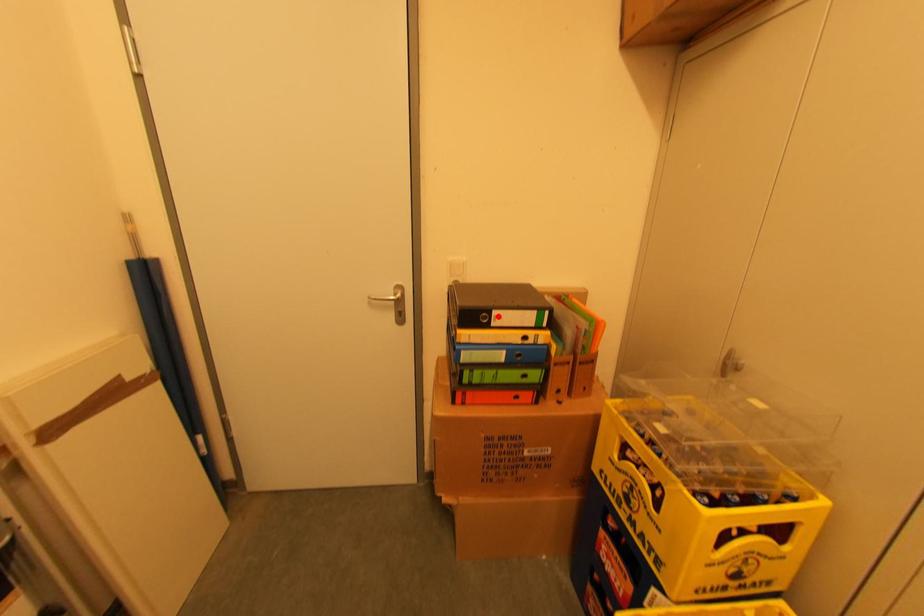
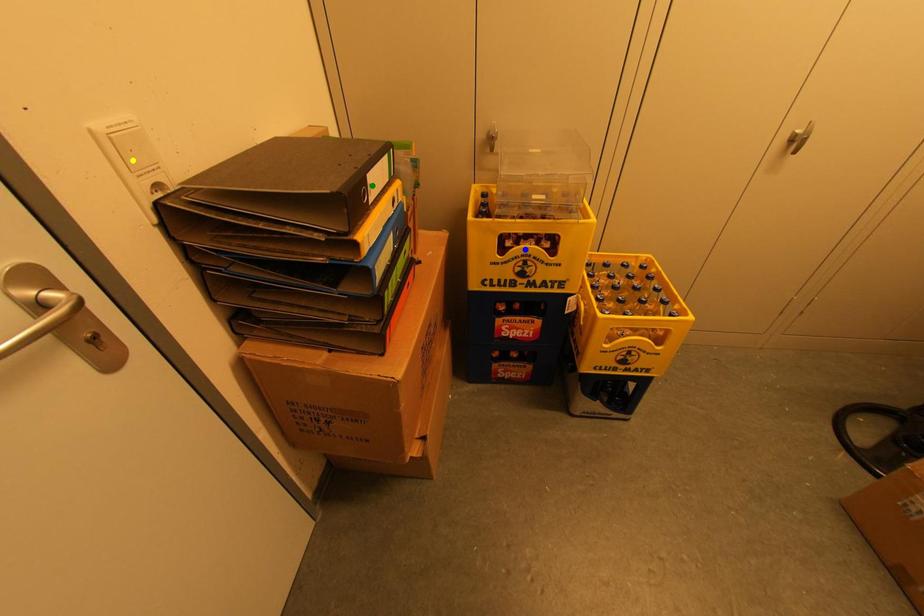
Question: I am providing you with two images of the same scene from different viewpoints. A red point is marked on the first image. You are given multiple points on the second image. Can you choose the point in image 2 that corresponds to the point in image 1?

Choices:
 (A) green point
 (B) yellow point
 (C) blue point

Answer: (A)